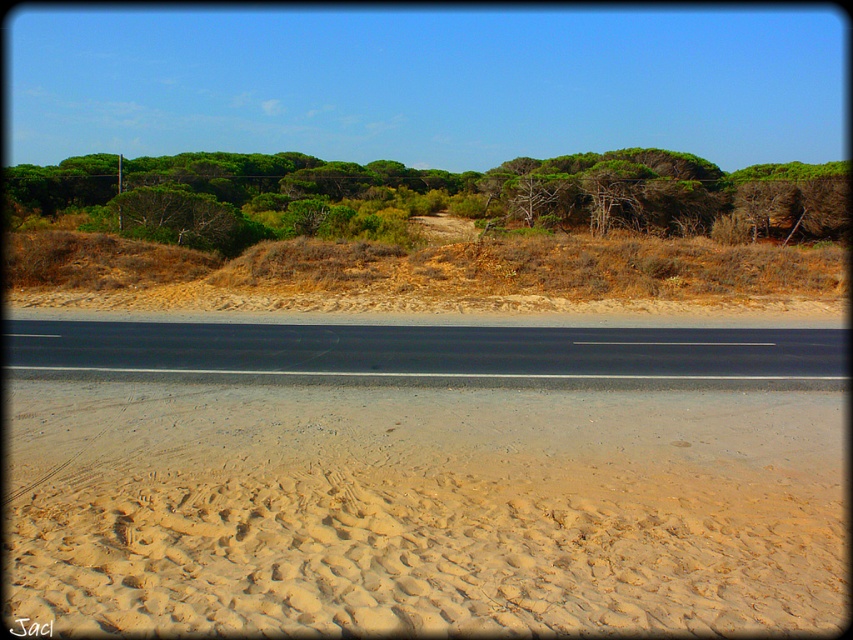
Question: Among these points, which one is nearest to the camera?

Choices:
 (A) (647, 372)
 (B) (715, 467)
 (C) (799, 173)

Answer: (B)

Question: Which point is closer to the camera?

Choices:
 (A) (593, 621)
 (B) (738, 353)

Answer: (A)

Question: Is light brown sandy beach at lower center positioned behind black asphalt road at center?

Choices:
 (A) no
 (B) yes

Answer: (A)

Question: Among these objects, which one is nearest to the camera?

Choices:
 (A) black asphalt road at center
 (B) light brown sandy beach at lower center

Answer: (B)

Question: Is light brown sandy beach at lower center to the left of green leafy trees at upper center from the viewer's perspective?

Choices:
 (A) yes
 (B) no

Answer: (B)

Question: From the image, what is the correct spatial relationship of light brown sandy beach at lower center in relation to black asphalt road at center?

Choices:
 (A) right
 (B) left

Answer: (B)